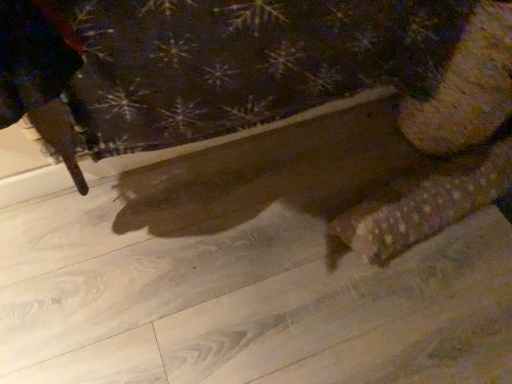
What do you see at coordinates (243, 62) in the screenshot? The height and width of the screenshot is (384, 512). I see `velvety brown blanket at upper center` at bounding box center [243, 62].

What are the coordinates of `velvety brown blanket at upper center` in the screenshot? It's located at (243, 62).

At what (x,y) coordinates should I click in order to perform the action: click on velvety brown blanket at upper center. Please return your answer as a coordinate pair (x, y). Looking at the image, I should click on coord(243,62).